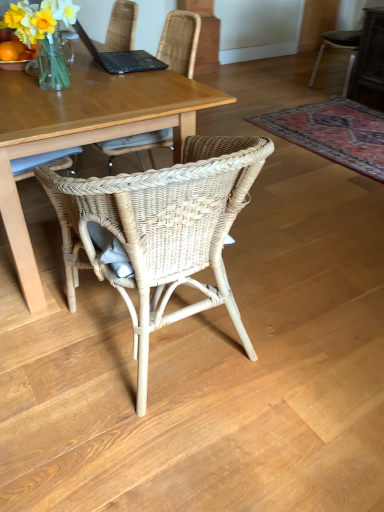
At what (x,y) coordinates should I click in order to perform the action: click on vacant space in between woven rattan chair at center, arranged as the 1th chair when ordered from the bottom, and matte wooden desk at center. Please return your answer as a coordinate pair (x, y). The height and width of the screenshot is (512, 384). Looking at the image, I should click on (85, 352).